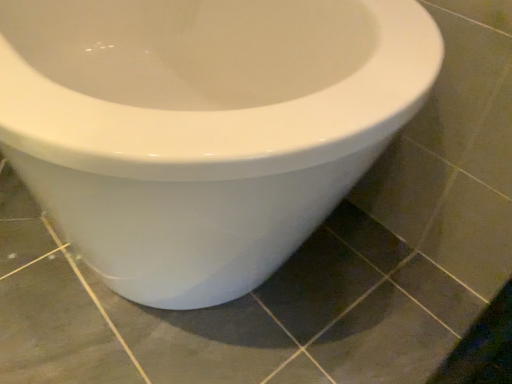
Locate an element on the screen. The width and height of the screenshot is (512, 384). white glossy toilet at center is located at coordinates click(x=203, y=127).

What do you see at coordinates (203, 127) in the screenshot? The height and width of the screenshot is (384, 512). I see `white glossy toilet at center` at bounding box center [203, 127].

Measure the distance between white glossy toilet at center and camera.

A distance of 46.97 centimeters exists between white glossy toilet at center and camera.

What is the approximate width of white glossy toilet at center?

white glossy toilet at center is 1.09 meters in width.

I want to click on white glossy toilet at center, so click(x=203, y=127).